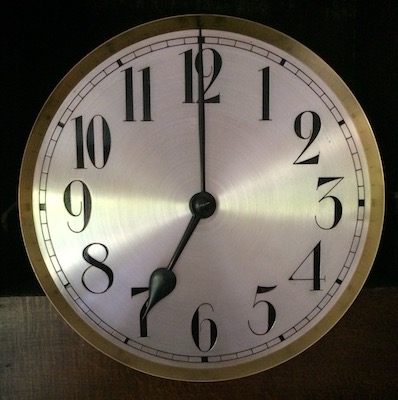
Find the location of a particular element. hour hand of clock is located at coordinates (165, 277).